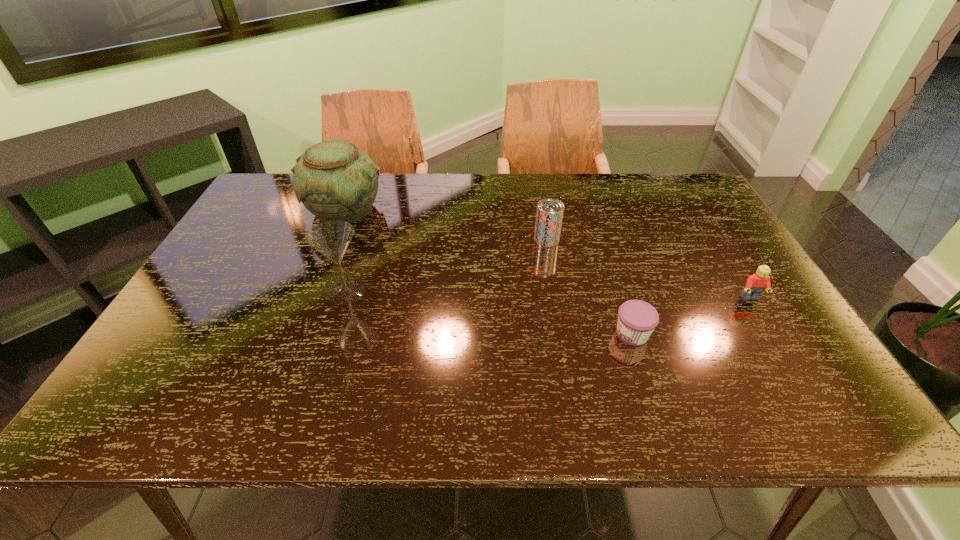
What are the coordinates of `pottery` in the screenshot? It's located at coord(335,180).

Where is `flute glass`? flute glass is located at coordinates (331, 238).

The height and width of the screenshot is (540, 960). I want to click on beer can, so click(x=549, y=216).

The width and height of the screenshot is (960, 540). Identify the location of Lego. (755, 284).

You are a GUI agent. You are given a task and a screenshot of the screen. Output one action in this format:
    pyautogui.click(x=<x>, y=<y>)
    Task: Click on the shortest object
    The image size is (960, 540).
    Given the screenshot: What is the action you would take?
    pyautogui.click(x=637, y=319)

Find the location of `the fourth object from left to right`. the fourth object from left to right is located at coordinates (637, 319).

What are the coordinates of `vacant space located on the right of the pottery` in the screenshot? It's located at (513, 210).

This screenshot has height=540, width=960. I want to click on vacant point located 0.350m on the right of the flute glass, so click(x=504, y=292).

The image size is (960, 540). I want to click on vacant space located 0.090m on the right of the third object from right to left, so click(x=590, y=239).

Where is `free space located 0.170m on the face of the Lego`? free space located 0.170m on the face of the Lego is located at coordinates (788, 360).